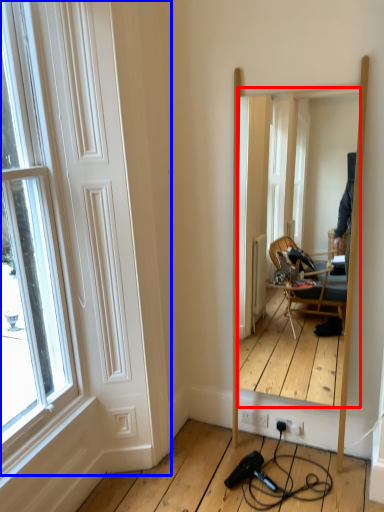
Question: Which object is closer to the camera taking this photo, mirror (highlighted by a red box) or door (highlighted by a blue box)?

Choices:
 (A) mirror
 (B) door

Answer: (B)